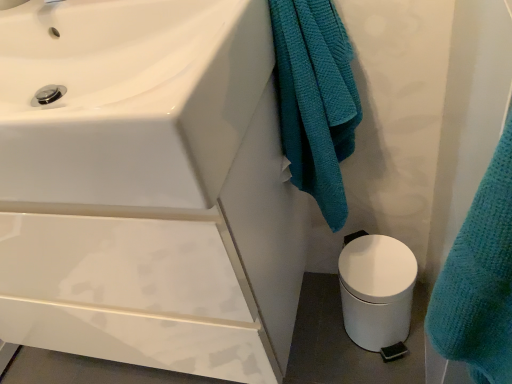
Question: Considering the relative positions of white glossy sink at upper left and white matte trash can at lower right in the image provided, is white glossy sink at upper left in front of white matte trash can at lower right?

Choices:
 (A) yes
 (B) no

Answer: (A)

Question: From a real-world perspective, is white glossy sink at upper left physically below white matte trash can at lower right?

Choices:
 (A) yes
 (B) no

Answer: (B)

Question: Is white glossy sink at upper left in contact with white matte trash can at lower right?

Choices:
 (A) yes
 (B) no

Answer: (B)

Question: Is white glossy sink at upper left outside white matte trash can at lower right?

Choices:
 (A) yes
 (B) no

Answer: (A)

Question: Does white glossy sink at upper left have a lesser height compared to white matte trash can at lower right?

Choices:
 (A) yes
 (B) no

Answer: (A)

Question: Visually, is white glossy sink at upper left positioned to the left or to the right of teal textured towel at center?

Choices:
 (A) right
 (B) left

Answer: (B)

Question: From a real-world perspective, is white glossy sink at upper left above or below teal textured towel at center?

Choices:
 (A) below
 (B) above

Answer: (B)

Question: Do you think white glossy sink at upper left is within teal textured towel at center, or outside of it?

Choices:
 (A) outside
 (B) inside

Answer: (A)

Question: Considering the positions of point click(x=13, y=46) and point click(x=289, y=48), is point click(x=13, y=46) closer or farther from the camera than point click(x=289, y=48)?

Choices:
 (A) closer
 (B) farther

Answer: (B)

Question: Is white matte trash can at lower right situated inside teal textured towel at center or outside?

Choices:
 (A) outside
 (B) inside

Answer: (A)

Question: In terms of size, does white matte trash can at lower right appear bigger or smaller than teal textured towel at center?

Choices:
 (A) big
 (B) small

Answer: (B)

Question: Relative to teal textured towel at center, is white matte trash can at lower right in front or behind?

Choices:
 (A) front
 (B) behind

Answer: (B)

Question: Looking at their shapes, would you say white matte trash can at lower right is wider or thinner than teal textured towel at center?

Choices:
 (A) thin
 (B) wide

Answer: (A)

Question: Is teal textured towel at center bigger or smaller than white glossy sink at upper left?

Choices:
 (A) big
 (B) small

Answer: (B)

Question: Is point (296, 185) closer or farther from the camera than point (179, 130)?

Choices:
 (A) closer
 (B) farther

Answer: (B)